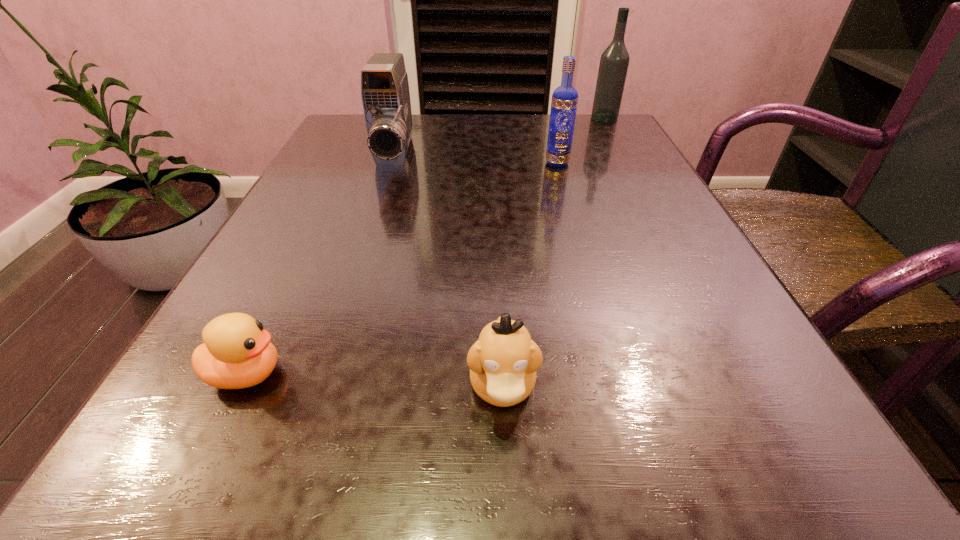
At what (x,y) coordinates should I click in order to perform the action: click on vacant area at the right edge of the desktop. Please return your answer as a coordinate pair (x, y). Looking at the image, I should click on (672, 201).

This screenshot has height=540, width=960. In order to click on vacant space at the far left corner of the desktop in this screenshot , I will do `click(362, 138)`.

Image resolution: width=960 pixels, height=540 pixels. In order to click on blank space at the near left corner in this screenshot , I will do `click(223, 450)`.

In the image, there is a desktop. At what (x,y) coordinates should I click in order to perform the action: click on vacant region at the far right corner. Please return your answer as a coordinate pair (x, y). The width and height of the screenshot is (960, 540). Looking at the image, I should click on (595, 123).

Find the location of a particular element. unoccupied area between the shortest object and the farther vodka is located at coordinates (425, 246).

Find the location of a particular element. The width and height of the screenshot is (960, 540). vacant point located between the second object from right to left and the left duckling is located at coordinates (402, 268).

You are a GUI agent. You are given a task and a screenshot of the screen. Output one action in this format:
    pyautogui.click(x=<x>, y=<y>)
    Task: Click on the free space between the second object from left to right and the left vodka
    
    Given the screenshot: What is the action you would take?
    pyautogui.click(x=476, y=159)

The width and height of the screenshot is (960, 540). Identify the location of free spot between the second object from left to right and the fourth tallest object. (448, 272).

The height and width of the screenshot is (540, 960). Find the location of `unoccupied position between the right vodka and the second shortest object`. unoccupied position between the right vodka and the second shortest object is located at coordinates (553, 253).

You are a GUI agent. You are given a task and a screenshot of the screen. Output one action in this format:
    pyautogui.click(x=<x>, y=<y>)
    Task: Click on the vacant area that lies between the right vodka and the leftmost object
    This screenshot has height=540, width=960.
    Given the screenshot: What is the action you would take?
    click(x=425, y=246)